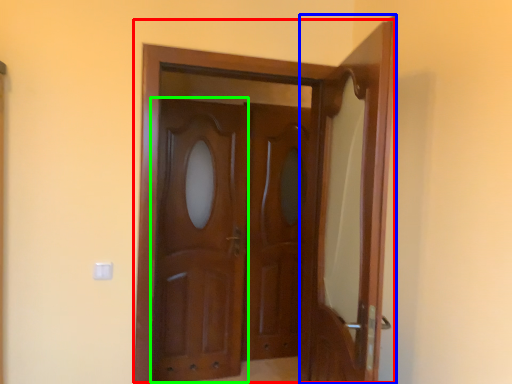
Question: Which object is positioned closest to door (highlighted by a red box)? Select from door (highlighted by a blue box) and barn door (highlighted by a green box).

Choices:
 (A) door
 (B) barn door

Answer: (A)